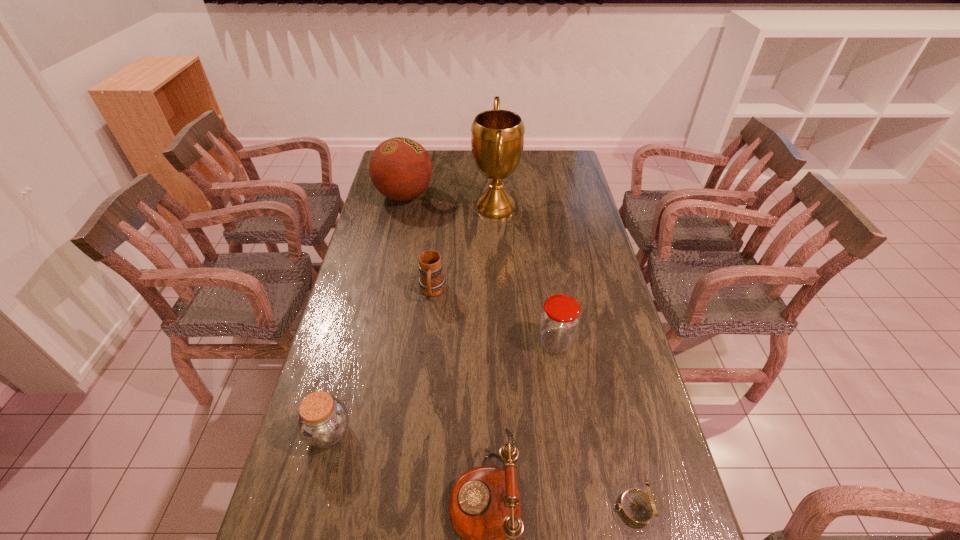
The image size is (960, 540). In order to click on jar present at the left edge in this screenshot , I will do `click(323, 419)`.

Where is `object positioned at the right edge`? The image size is (960, 540). object positioned at the right edge is located at coordinates (638, 507).

What are the coordinates of `vacant position at the far edge of the desktop` in the screenshot? It's located at (525, 155).

Where is `vacant space at the left edge`? vacant space at the left edge is located at coordinates (362, 389).

In the image, there is a desktop. At what (x,y) coordinates should I click in order to perform the action: click on vacant space at the right edge. Please return your answer as a coordinate pair (x, y). Looking at the image, I should click on (663, 441).

You are a GUI agent. You are given a task and a screenshot of the screen. Output one action in this format:
    pyautogui.click(x=<x>, y=<y>)
    Task: Click on the vacant space at the far right corner
    This screenshot has height=540, width=960.
    Given the screenshot: What is the action you would take?
    pyautogui.click(x=554, y=160)

Identify the location of empty space between the nearer jar and the mug. The image size is (960, 540). (380, 362).

Find the location of a particular element. This screenshot has width=960, height=540. empty space between the shortest object and the fourth nearest object is located at coordinates [595, 425].

At what (x,y) coordinates should I click in order to perform the action: click on free space that is in between the trophy cup and the fourth farthest object. Please return your answer as a coordinate pair (x, y). The image size is (960, 540). Looking at the image, I should click on (526, 274).

Locate an element on the screen. The image size is (960, 540). vacant space that's between the tallest object and the third farthest object is located at coordinates (464, 249).